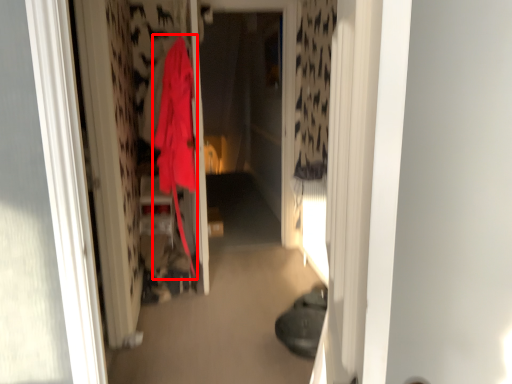
Question: From the image's perspective, where is cloak (annotated by the red box) located relative to screen door?

Choices:
 (A) below
 (B) above

Answer: (A)